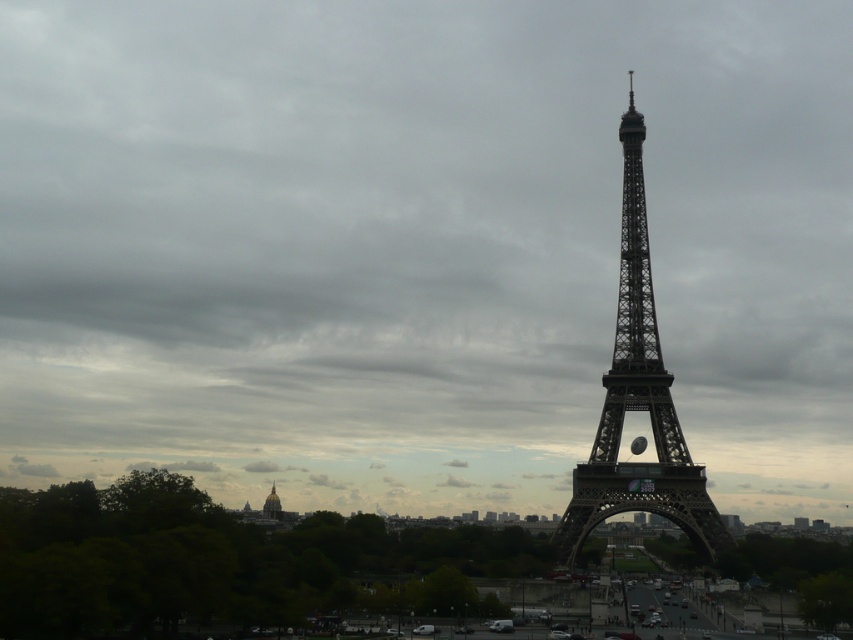
You are a photographer planning to take a picture of the Eiffel Tower. You want to ensure the metallic structure at center is positioned precisely at the center of the image. Given its current coordinates at point 0.627, 0.748, should you adjust your camera angle to move it left or right to center it horizontally?

The metallic structure at center is located at point (637,401). To center it horizontally, since the x coordinate 0.627 is greater than 0.5, you should move the camera angle to the right to bring the structure closer to the center.

You are a tourist standing at the base of the Eiffel Tower and want to take a photo that includes both the metallic structure at center and the golden dome building at lower center. Which object should you focus on first to ensure both are in frame?

You should focus on the metallic structure at center first because it is much taller than the golden dome building at lower center, so you need to adjust your camera angle to include its full height while still capturing the golden dome building at lower center in the foreground.

You are a tourist standing in front of the Eiffel Tower and want to take a photo that includes both the metallic structure at center and the golden dome building at lower center. Which object should you position closer to the camera to ensure both are in focus?

To ensure both the metallic structure at center and the golden dome building at lower center are in focus, position the metallic structure at center closer to the camera since it is in front of the golden dome building at lower center.